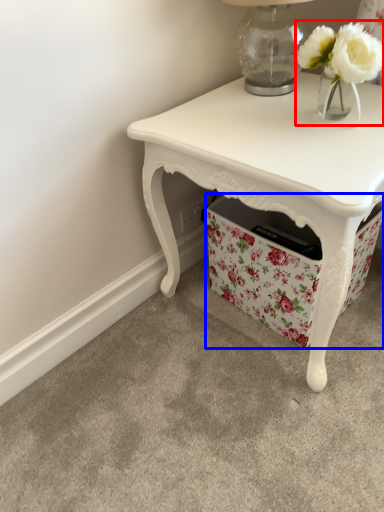
Question: Which point is further to the camera, floral arrangement (highlighted by a red box) or storage box (highlighted by a blue box)?

Choices:
 (A) floral arrangement
 (B) storage box

Answer: (B)